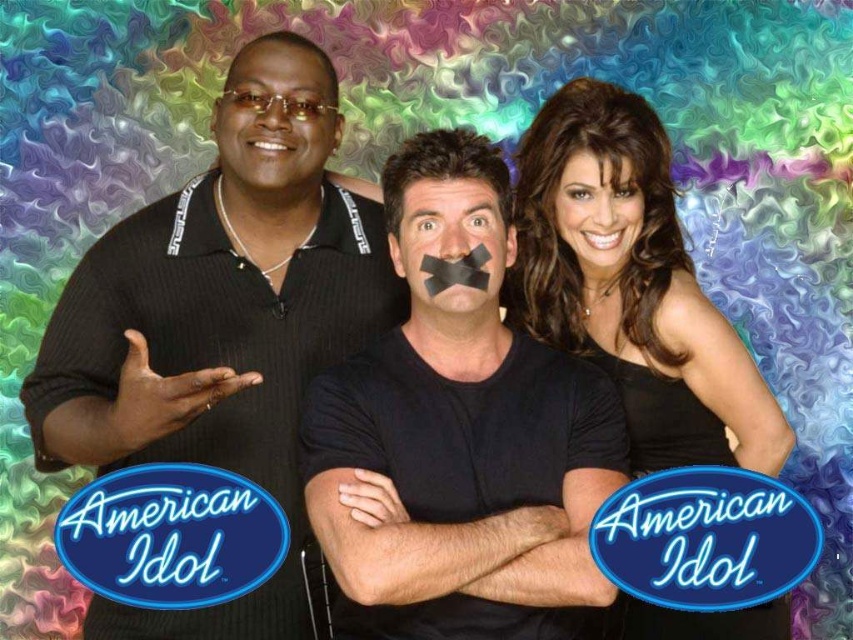
Which of these two, matte black face at left or black matte tape at center, stands taller?

Standing taller between the two is matte black face at left.

Does matte black face at left appear under black matte tape at center?

Incorrect, matte black face at left is not positioned below black matte tape at center.

Is point (253, 90) in front of point (480, 220)?

Yes, it is.

The image size is (853, 640). I want to click on matte black face at left, so click(x=276, y=115).

Can you confirm if black textured shirt at left is thinner than black matte t-shirt at center?

Incorrect, black textured shirt at left's width is not less than black matte t-shirt at center's.

Where is `black textured shirt at left`? The height and width of the screenshot is (640, 853). black textured shirt at left is located at coordinates (219, 323).

Where is `black textured shirt at left`? The image size is (853, 640). black textured shirt at left is located at coordinates (219, 323).

Can you confirm if black satin dress at center is shorter than matte black face at left?

No.

Can you confirm if black satin dress at center is positioned above matte black face at left?

Actually, black satin dress at center is below matte black face at left.

Does point (654, 262) lie behind point (283, 115)?

Yes, it is behind point (283, 115).

Identify the location of black satin dress at center. The image size is (853, 640). (631, 284).